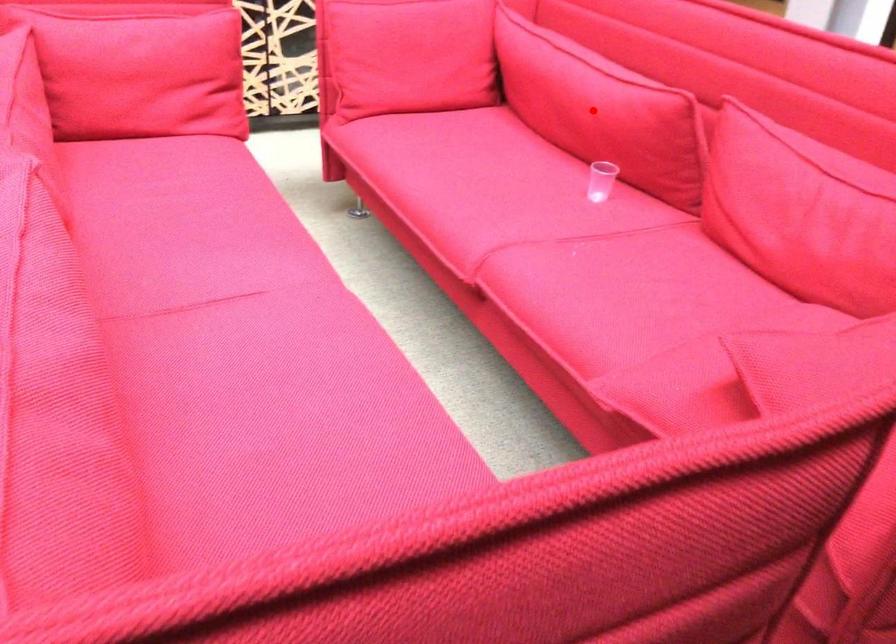
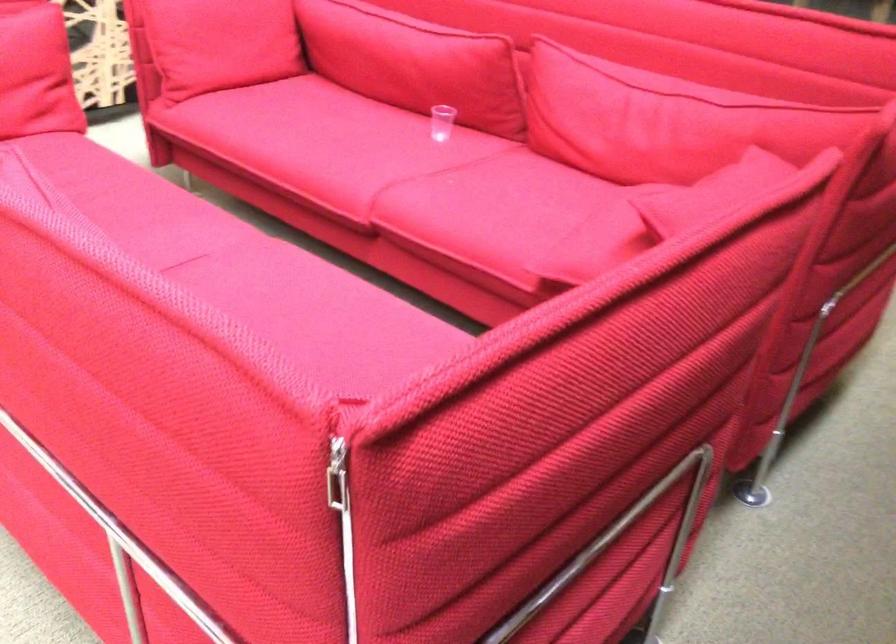
The point at the highlighted location is marked in the first image. Where is the corresponding point in the second image?

(414, 62)